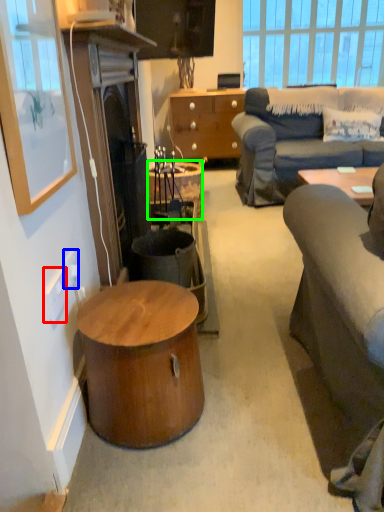
Question: Which object is the farthest from power outlet (highlighted by a red box)? Choose among these: power outlet (highlighted by a blue box) or desk (highlighted by a green box).

Choices:
 (A) power outlet
 (B) desk

Answer: (B)